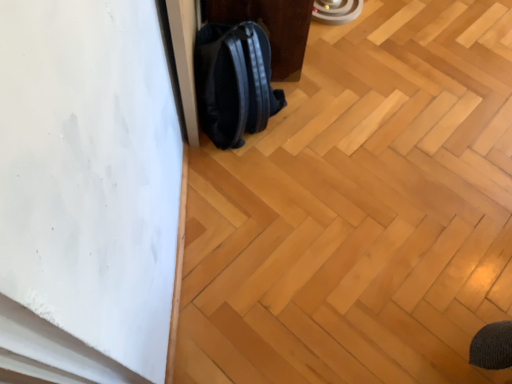
Question: Does black matte backpack at center have a greater height compared to black leather backpack at lower left?

Choices:
 (A) no
 (B) yes

Answer: (B)

Question: Does black matte backpack at center have a greater width compared to black leather backpack at lower left?

Choices:
 (A) yes
 (B) no

Answer: (B)

Question: Are black matte backpack at center and black leather backpack at lower left far apart?

Choices:
 (A) no
 (B) yes

Answer: (A)

Question: Is black leather backpack at lower left completely or partially inside black matte backpack at center?

Choices:
 (A) no
 (B) yes

Answer: (A)

Question: Is black matte backpack at center at the right side of black leather backpack at lower left?

Choices:
 (A) yes
 (B) no

Answer: (B)

Question: Considering the relative sizes of black matte backpack at center and black leather backpack at lower left in the image provided, is black matte backpack at center smaller than black leather backpack at lower left?

Choices:
 (A) yes
 (B) no

Answer: (A)

Question: Is black leather backpack at lower left at the back of natural wood floor at center?

Choices:
 (A) yes
 (B) no

Answer: (B)

Question: Can you confirm if natural wood floor at center is wider than black leather backpack at lower left?

Choices:
 (A) no
 (B) yes

Answer: (B)

Question: Is natural wood floor at center at the right side of black leather backpack at lower left?

Choices:
 (A) yes
 (B) no

Answer: (A)

Question: Considering the relative positions of natural wood floor at center and black leather backpack at lower left in the image provided, is natural wood floor at center to the left of black leather backpack at lower left from the viewer's perspective?

Choices:
 (A) no
 (B) yes

Answer: (A)

Question: Is natural wood floor at center further to camera compared to black leather backpack at lower left?

Choices:
 (A) yes
 (B) no

Answer: (B)

Question: Is natural wood floor at center smaller than black leather backpack at lower left?

Choices:
 (A) no
 (B) yes

Answer: (A)

Question: Is black leather backpack at lower left to the left of black matte backpack at center from the viewer's perspective?

Choices:
 (A) no
 (B) yes

Answer: (A)